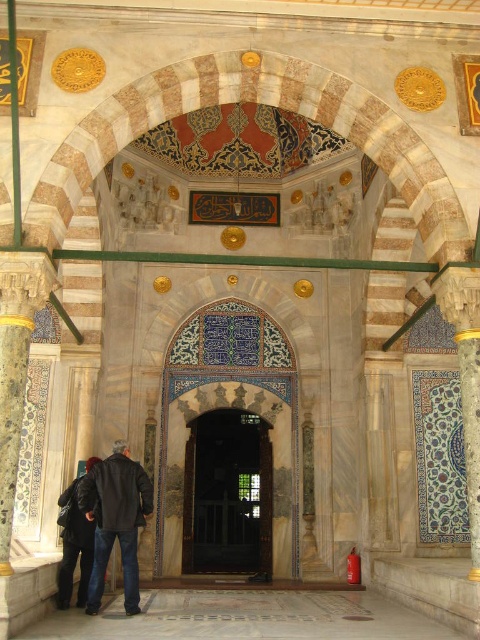
You are an interior designer assessing the space. You notice the blue glazed tile at center and the dark blue leather jacket at lower left. Which object is bigger in size?

The blue glazed tile at center has a larger size compared to the dark blue leather jacket at lower left.

In the scene shown: You are a tour guide leading a group through this historical building. You notice a blue glazed tile at center and a dark blue leather jacket at lower left. Can you determine if the distance between them is sufficient for a visitor to comfortably walk between them without feeling cramped?

The distance between the blue glazed tile at center and the dark blue leather jacket at lower left is 83.96 feet, which is more than enough space for visitors to comfortably walk between them without feeling cramped.